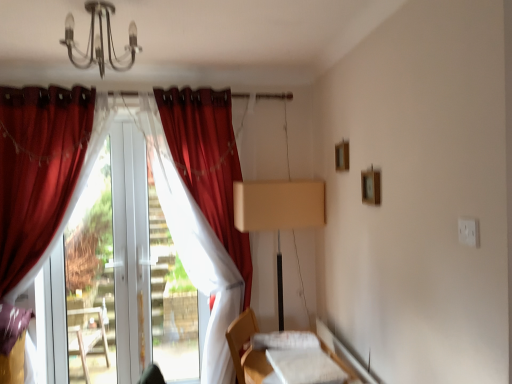
Image resolution: width=512 pixels, height=384 pixels. What do you see at coordinates (172, 301) in the screenshot?
I see `transparent plastic window screen at center` at bounding box center [172, 301].

Identify the location of white fabric bed at lower center. The width and height of the screenshot is (512, 384). tap(241, 340).

You are a GUI agent. You are given a task and a screenshot of the screen. Output one action in this format:
    pyautogui.click(x=<x>, y=<y>)
    Task: Click on the red velvet curtain at left, the 2th curtain from the right
    
    Given the screenshot: What is the action you would take?
    pyautogui.click(x=194, y=245)

Is red velvet curtain at left, the 2th curtain from the right, situated inside transparent plastic window screen at center or outside?

red velvet curtain at left, the 2th curtain from the right, lies within the bounds of transparent plastic window screen at center.

Considering the relative positions of red velvet curtain at left, which appears as the second curtain when viewed from the left, and transparent plastic window screen at center in the image provided, is red velvet curtain at left, which appears as the second curtain when viewed from the left, to the left or to the right of transparent plastic window screen at center?

Clearly, red velvet curtain at left, which appears as the second curtain when viewed from the left, is on the left of transparent plastic window screen at center in the image.

Is red velvet curtain at left, which appears as the second curtain when viewed from the left, far from transparent plastic window screen at center?

No, red velvet curtain at left, which appears as the second curtain when viewed from the left, is not far away from transparent plastic window screen at center.

Who is shorter, velvet red curtain at left, which appears as the first curtain when viewed from the right, or red velvet curtain at left, the 2th curtain from the right?

red velvet curtain at left, the 2th curtain from the right, is shorter.

Is velvet red curtain at left, the third curtain from the left, far from red velvet curtain at left, the 2th curtain from the right?

They are positioned close to each other.

Consider the image. Is red velvet curtain at left, the 2th curtain from the right, a part of velvet red curtain at left, the third curtain from the left?

No, velvet red curtain at left, the third curtain from the left, does not contain red velvet curtain at left, the 2th curtain from the right.

Can you tell me how much transparent plastic window screen at center and white fabric at lower right differ in facing direction?

The angular difference between transparent plastic window screen at center and white fabric at lower right is 86.1 degrees.

At what (x,y) coordinates should I click in order to perform the action: click on window screen above the white fabric at lower right (from the image's perspective). Please return your answer as a coordinate pair (x, y). The height and width of the screenshot is (384, 512). Looking at the image, I should click on (172, 301).

Measure the distance between transparent plastic window screen at center and white fabric at lower right.

transparent plastic window screen at center and white fabric at lower right are 1.24 meters apart.

Is the position of transparent plastic window screen at center more distant than that of white fabric at lower right?

Yes, it is behind white fabric at lower right.

In the image, is velvet red curtain at left, the third curtain from the left, positioned in front of or behind metallic chandelier at upper center?

In the image, velvet red curtain at left, the third curtain from the left, appears behind metallic chandelier at upper center.

Consider the image. From a real-world perspective, between velvet red curtain at left, which appears as the first curtain when viewed from the right, and metallic chandelier at upper center, who is vertically higher?

metallic chandelier at upper center.

Is there a large distance between velvet red curtain at left, which appears as the first curtain when viewed from the right, and metallic chandelier at upper center?

No, velvet red curtain at left, which appears as the first curtain when viewed from the right, is not far from metallic chandelier at upper center.

Is velvet red curtain at left, the third curtain from the left, at the right side of metallic chandelier at upper center?

Correct, you'll find velvet red curtain at left, the third curtain from the left, to the right of metallic chandelier at upper center.

Is white fabric at lower right surrounding white fabric bed at lower center?

No, white fabric bed at lower center is located outside of white fabric at lower right.

From a real-world perspective, does white fabric at lower right sit lower than white fabric bed at lower center?

No, from a real-world perspective, white fabric at lower right is not under white fabric bed at lower center.

Is white fabric at lower right oriented towards white fabric bed at lower center?

No, white fabric at lower right is not facing towards white fabric bed at lower center.

How distant is white fabric at lower right from white fabric bed at lower center?

white fabric at lower right and white fabric bed at lower center are 17.63 centimeters apart from each other.

Which object is positioned more to the left, matte red curtain at left, which ranks as the first curtain in left-to-right order, or velvet red curtain at left, which appears as the first curtain when viewed from the right?

matte red curtain at left, which ranks as the first curtain in left-to-right order.

Considering the sizes of objects matte red curtain at left, which ranks as the 3th curtain in right-to-left order, and velvet red curtain at left, the third curtain from the left, in the image provided, who is bigger, matte red curtain at left, which ranks as the 3th curtain in right-to-left order, or velvet red curtain at left, the third curtain from the left,?

Bigger between the two is velvet red curtain at left, the third curtain from the left.

I want to click on curtain that is the 2nd object to the left of the velvet red curtain at left, the third curtain from the left, starting at the anchor, so click(x=42, y=171).

Which is behind, point (54, 135) or point (93, 24)?

The point (54, 135) is farther.

Who is shorter, matte red curtain at left, which ranks as the 3th curtain in right-to-left order, or metallic chandelier at upper center?

Standing shorter between the two is metallic chandelier at upper center.

In the image, is matte red curtain at left, which ranks as the 3th curtain in right-to-left order, on the left side or the right side of metallic chandelier at upper center?

Clearly, matte red curtain at left, which ranks as the 3th curtain in right-to-left order, is on the left of metallic chandelier at upper center in the image.

Between matte red curtain at left, which ranks as the 3th curtain in right-to-left order, and metallic chandelier at upper center, which one is positioned behind?

Positioned behind is matte red curtain at left, which ranks as the 3th curtain in right-to-left order.

Find the location of `window screen that appears on the right of red velvet curtain at left, the 2th curtain from the right`. window screen that appears on the right of red velvet curtain at left, the 2th curtain from the right is located at coordinates (172, 301).

From a real-world perspective, which curtain is the 1st one above the red velvet curtain at left, the 2th curtain from the right? Please provide its 2D coordinates.

[(208, 162)]

Estimate the real-world distances between objects in this image. Which object is further from metallic chandelier at upper center, matte red curtain at left, which ranks as the first curtain in left-to-right order, or red velvet curtain at left, the 2th curtain from the right?

Among the two, red velvet curtain at left, the 2th curtain from the right, is located further to metallic chandelier at upper center.

When comparing their distances from white fabric bed at lower center, does transparent plastic window screen at center or white fabric at lower right seem further?

Among the two, transparent plastic window screen at center is located further to white fabric bed at lower center.

From the image, which object appears to be farther from white fabric bed at lower center, matte red curtain at left, which ranks as the 3th curtain in right-to-left order, or red velvet curtain at left, the 2th curtain from the right?

matte red curtain at left, which ranks as the 3th curtain in right-to-left order.

Based on the photo, looking at the image, which one is located further to transparent plastic window screen at center, beige matte table lamp at center or metallic chandelier at upper center?

metallic chandelier at upper center.

Based on their spatial positions, is velvet red curtain at left, the third curtain from the left, or matte red curtain at left, which ranks as the 3th curtain in right-to-left order, further from transparent plastic window screen at center?

The object further to transparent plastic window screen at center is matte red curtain at left, which ranks as the 3th curtain in right-to-left order.

Which object lies nearer to the anchor point transparent plastic window screen at center, velvet red curtain at left, which appears as the first curtain when viewed from the right, or white fabric bed at lower center?

velvet red curtain at left, which appears as the first curtain when viewed from the right.

From the image, which object appears to be farther from white fabric bed at lower center, red velvet curtain at left, the 2th curtain from the right, or metallic chandelier at upper center?

Among the two, metallic chandelier at upper center is located further to white fabric bed at lower center.

From the image, which object appears to be nearer to velvet red curtain at left, which appears as the first curtain when viewed from the right, white fabric bed at lower center or beige matte table lamp at center?

beige matte table lamp at center lies closer to velvet red curtain at left, which appears as the first curtain when viewed from the right, than the other object.

Find the location of a particular element. Image resolution: width=512 pixels, height=384 pixels. bed between red velvet curtain at left, which appears as the second curtain when viewed from the left, and beige matte table lamp at center, in the horizontal direction is located at coordinates (241, 340).

Image resolution: width=512 pixels, height=384 pixels. Find the location of `light fixture between matte red curtain at left, which ranks as the first curtain in left-to-right order, and beige matte table lamp at center`. light fixture between matte red curtain at left, which ranks as the first curtain in left-to-right order, and beige matte table lamp at center is located at coordinates (100, 40).

Image resolution: width=512 pixels, height=384 pixels. Identify the location of sheet positioned between metallic chandelier at upper center and red velvet curtain at left, which appears as the second curtain when viewed from the left, from near to far. (305, 366).

In order to click on table lamp between white fabric at lower right and red velvet curtain at left, which appears as the second curtain when viewed from the left, along the z-axis in this screenshot , I will do `click(280, 216)`.